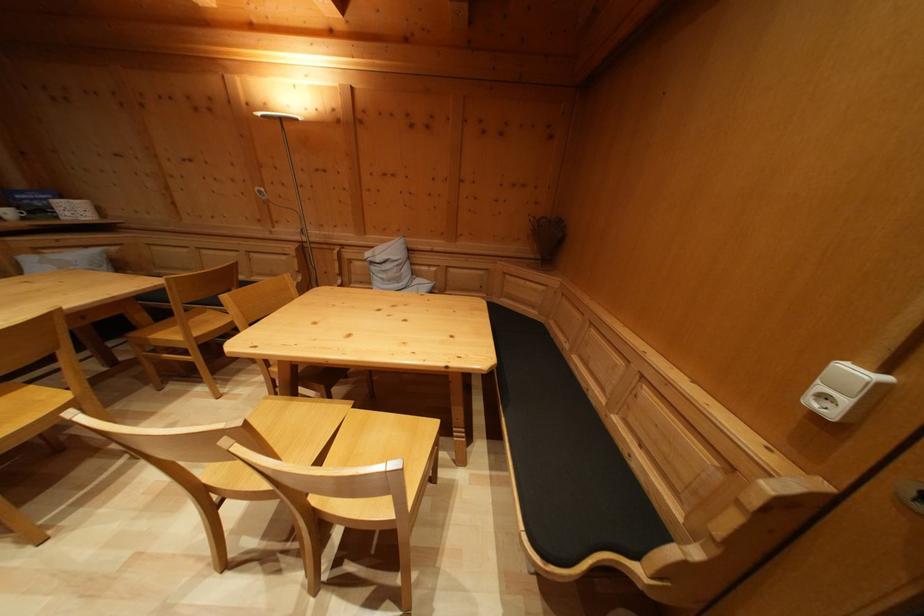
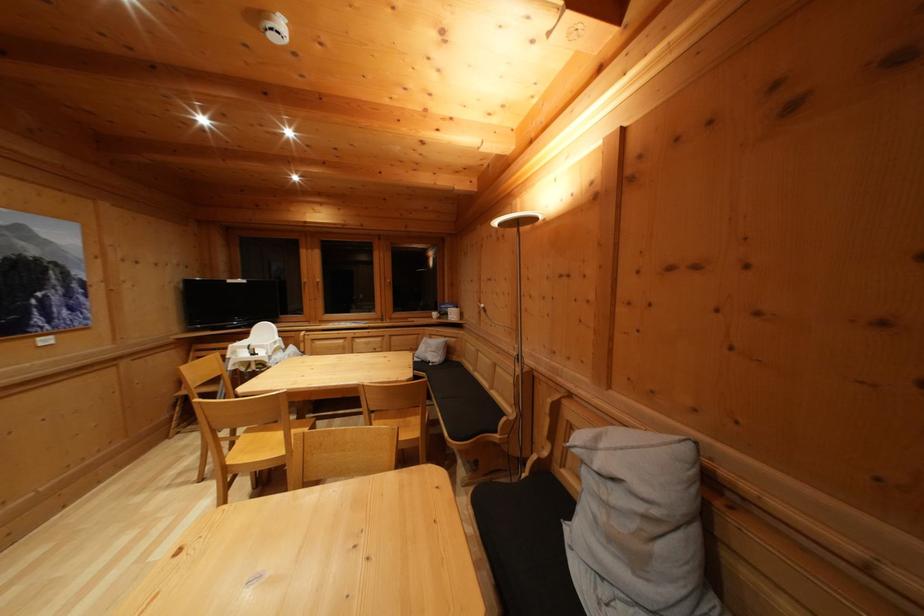
Question: I am providing you with two images of the same scene from different viewpoints. Please identify which objects are invisible in image2.

Choices:
 (A) sofa sitting surface
 (B) bench sitting surface
 (C) window handle
 (D) none of these

Answer: (D)